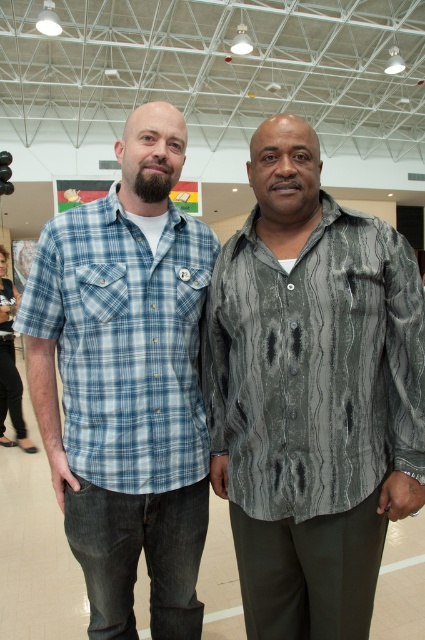
You are standing in the center of the room and see two points marked in the image. The first point is at coordinates point (x=337, y=330) and the second is at point (x=45, y=323). Which of these two points is closer to you?

Point (x=337, y=330) is in front of point (x=45, y=323), so the first point is closer to you.